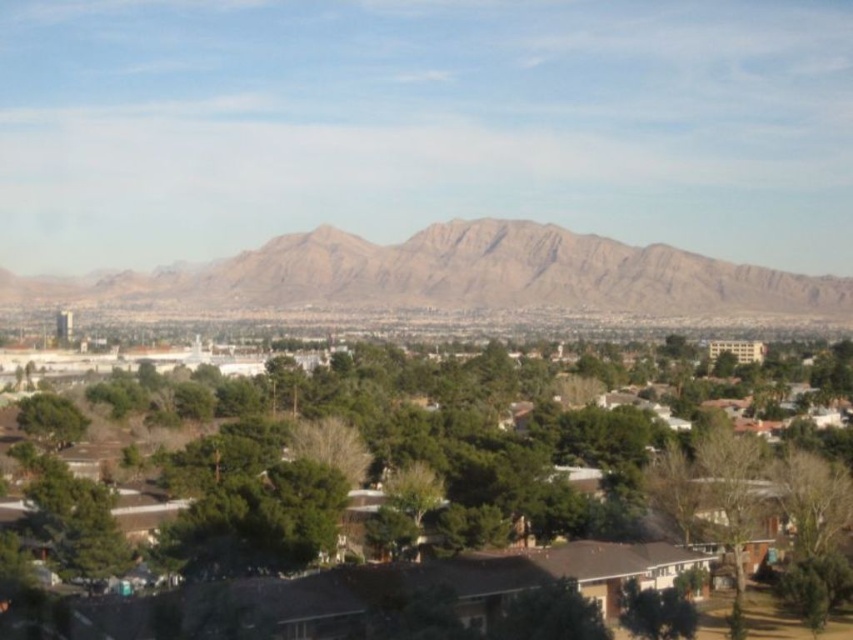
You are standing at the center of the suburban area and want to locate the green leafy tree at center. According to the coordinates provided, in which direction should you look to find it?

The green leafy tree at center is located at coordinates point [402,506]. Since the coordinates are based on a standard grid where the center is [426,320], the tree is positioned to the right and slightly above the center point. Therefore, you should look towards the upper right direction from your current position at the center.

You are an architect designing a new park in this suburban area. You want to place a large sculpture between the green leafy tree at center and the brown rocky mountain range at center. Considering their widths, which object should the sculpture be closer to?

The sculpture should be closer to the green leafy tree at center because it is thinner than the brown rocky mountain range at center, allowing more space around the sculpture.